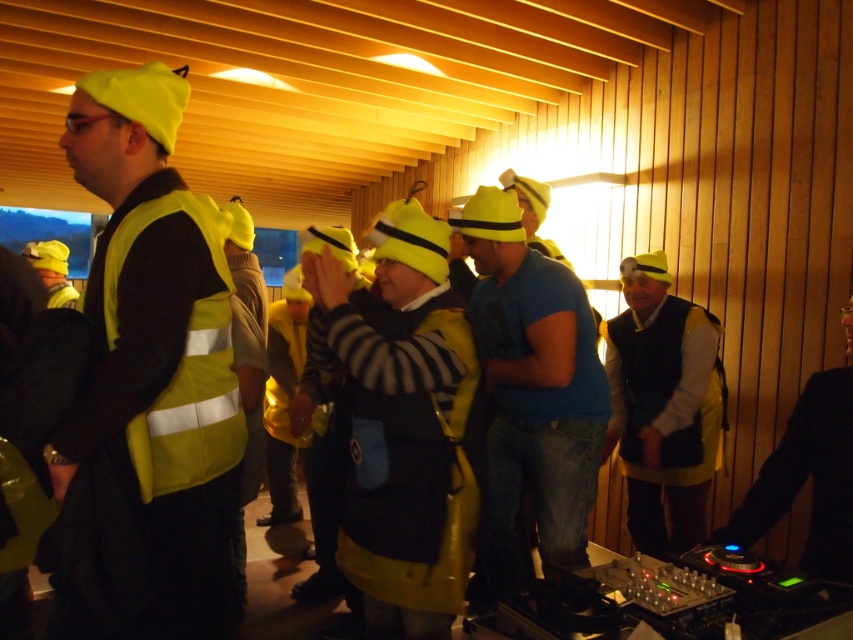
You are organizing a safety demonstration and need to ensure that the vests are appropriately sized for participants. Given that the matte yellow vest at center is narrower than the yellow reflective vest at center, which vest would be more suitable for a participant who requires a wider vest for visibility?

The yellow reflective vest at center is wider than the matte yellow vest at center, making it more suitable for a participant requiring a wider vest for visibility.